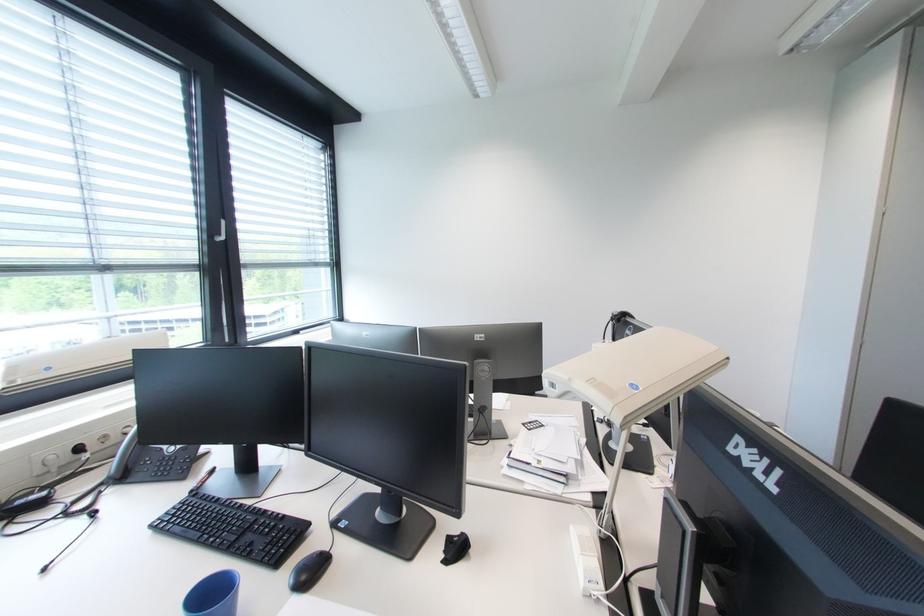
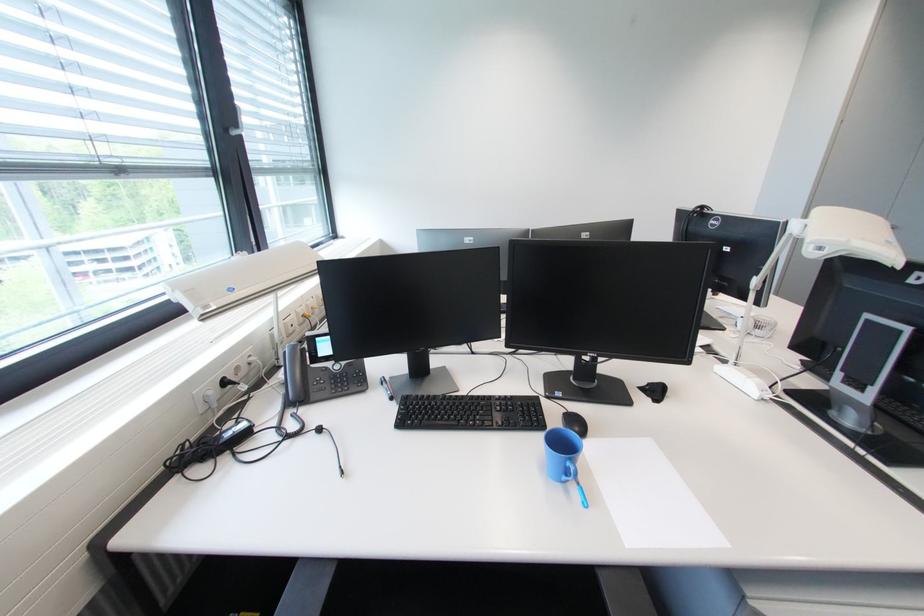
In the second image, find the point that corresponds to (x=468, y=536) in the first image.

(655, 386)